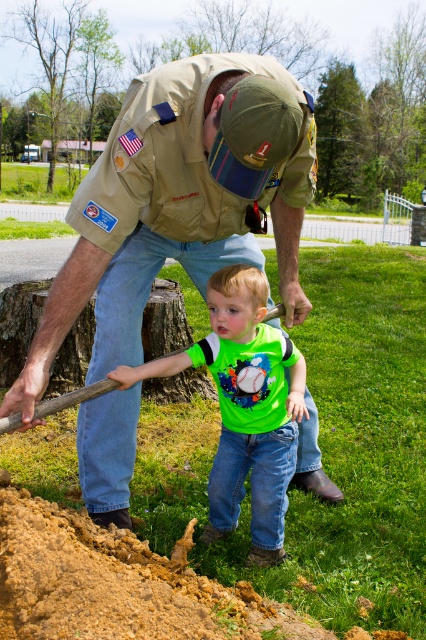
Which of these two, khaki uniform at center or brown sandy soil at lower left, stands taller?

khaki uniform at center is taller.

Who is more distant from viewer, (131, 186) or (154, 596)?

The point (131, 186) is more distant.

The image size is (426, 640). I want to click on khaki uniform at center, so coord(180,202).

Is brown sandy soil at lower left shorter than green matte shirt at center?

Yes.

In the scene shown: Does brown sandy soil at lower left have a smaller size compared to green matte shirt at center?

Indeed, brown sandy soil at lower left has a smaller size compared to green matte shirt at center.

At what (x,y) coordinates should I click in order to perform the action: click on brown sandy soil at lower left. Please return your answer as a coordinate pair (x, y). Looking at the image, I should click on (118, 586).

Does khaki uniform at center appear over green matte shirt at center?

Yes, khaki uniform at center is above green matte shirt at center.

What do you see at coordinates (180, 202) in the screenshot? The height and width of the screenshot is (640, 426). I see `khaki uniform at center` at bounding box center [180, 202].

Where is `khaki uniform at center`? This screenshot has width=426, height=640. khaki uniform at center is located at coordinates (180, 202).